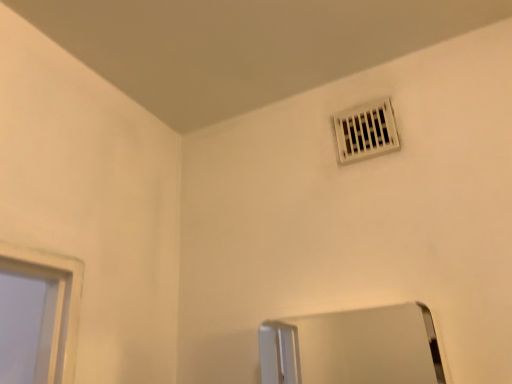
What are the coordinates of `white plastic air conditioning at upper center` in the screenshot? It's located at (366, 131).

This screenshot has height=384, width=512. Describe the element at coordinates (366, 131) in the screenshot. I see `white plastic air conditioning at upper center` at that location.

At what (x,y) coordinates should I click in order to perform the action: click on white plastic air conditioning at upper center. Please return your answer as a coordinate pair (x, y). Looking at the image, I should click on (366, 131).